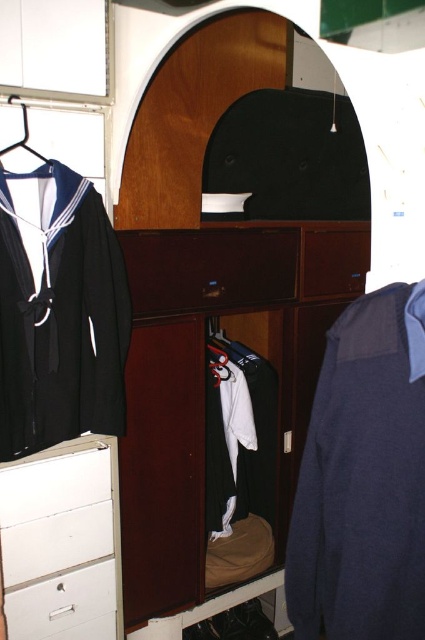
The width and height of the screenshot is (425, 640). I want to click on sailor blue fabric jacket at left, so pyautogui.click(x=59, y=312).

Looking at this image, does sailor blue fabric jacket at left appear over metallic silver hanger at left?

No.

Is point (22, 227) farther from camera compared to point (23, 145)?

No, it is not.

Where is `sailor blue fabric jacket at left`? sailor blue fabric jacket at left is located at coordinates (59, 312).

Who is positioned more to the left, navy blue sweater at center or white painted wood file cabinet at lower left?

white painted wood file cabinet at lower left

Is point (353, 552) farther from viewer compared to point (16, 500)?

No.

Is point (311, 438) behind point (87, 496)?

That is False.

Where is `navy blue sweater at center`? The width and height of the screenshot is (425, 640). navy blue sweater at center is located at coordinates (363, 477).

Does point (382, 550) lie behind point (19, 625)?

No, (382, 550) is closer to viewer.

Is navy blue sweater at center below white plastic drawer at lower left?

No.

Identify the location of navy blue sweater at center. The height and width of the screenshot is (640, 425). (363, 477).